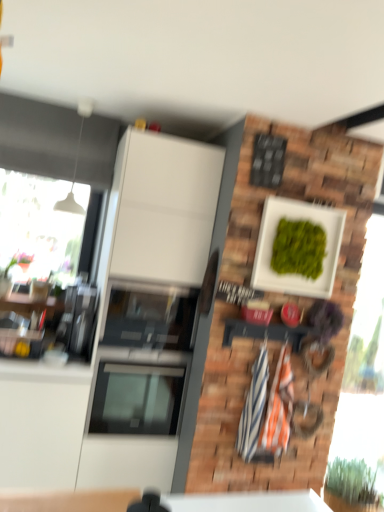
Question: Is white glossy cabinet at center positioned with its back to green leafy plant at lower right?

Choices:
 (A) no
 (B) yes

Answer: (A)

Question: From the image's perspective, is white glossy cabinet at center located beneath green leafy plant at lower right?

Choices:
 (A) yes
 (B) no

Answer: (B)

Question: From the image's perspective, is white glossy cabinet at center on green leafy plant at lower right?

Choices:
 (A) no
 (B) yes

Answer: (B)

Question: Is white glossy cabinet at center not inside green leafy plant at lower right?

Choices:
 (A) no
 (B) yes

Answer: (B)

Question: Does white glossy cabinet at center lie behind green leafy plant at lower right?

Choices:
 (A) no
 (B) yes

Answer: (A)

Question: Could you tell me if white glossy cabinet at center is turned towards green leafy plant at lower right?

Choices:
 (A) no
 (B) yes

Answer: (A)

Question: Can you confirm if white glossy cabinet at center is positioned to the right of white matte wall at upper center?

Choices:
 (A) yes
 (B) no

Answer: (B)

Question: From a real-world perspective, is white glossy cabinet at center under white matte wall at upper center?

Choices:
 (A) no
 (B) yes

Answer: (B)

Question: Is white glossy cabinet at center next to white matte wall at upper center and touching it?

Choices:
 (A) yes
 (B) no

Answer: (B)

Question: Can you confirm if white glossy cabinet at center is shorter than white matte wall at upper center?

Choices:
 (A) no
 (B) yes

Answer: (A)

Question: Would you say white glossy cabinet at center contains white matte wall at upper center?

Choices:
 (A) yes
 (B) no

Answer: (B)

Question: From the image's perspective, is white glossy cabinet at center under white matte wall at upper center?

Choices:
 (A) yes
 (B) no

Answer: (A)

Question: Is green leafy plant at lower right facing towards white matte wall at upper center?

Choices:
 (A) yes
 (B) no

Answer: (B)